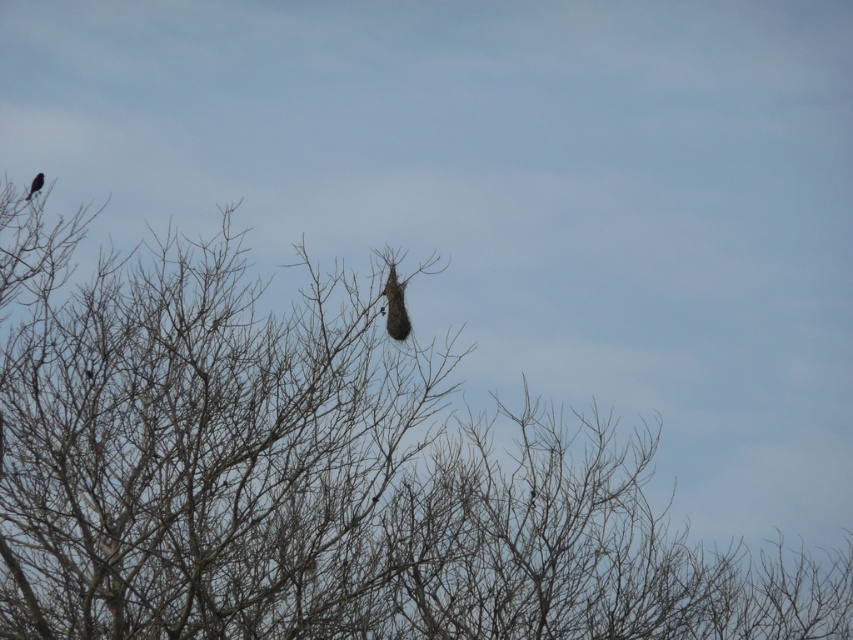
You are a photographer standing in front of the tree. You want to capture a closeup of the dark brown feathered bird at center. Based on its position, where should you aim your camera to ensure the bird is centered in your shot?

To center the dark brown feathered bird at center in your shot, aim your camera at the coordinates point (395,307), as that is the 2D location of the bird.

You are standing in front of the tree and notice two points marked in the image. The first point is at coordinates point (833, 588) and the second is at point (33, 186). Which point is closer to you?

Point (833, 588) is closer to the viewer than point (33, 186).

You are standing at a point 90.54 feet away from the point marked as point (401, 305) in the image. If you want to move closer to this point, which direction should you walk?

You should walk towards the point marked as point (401, 305) to reduce the distance between you and it.